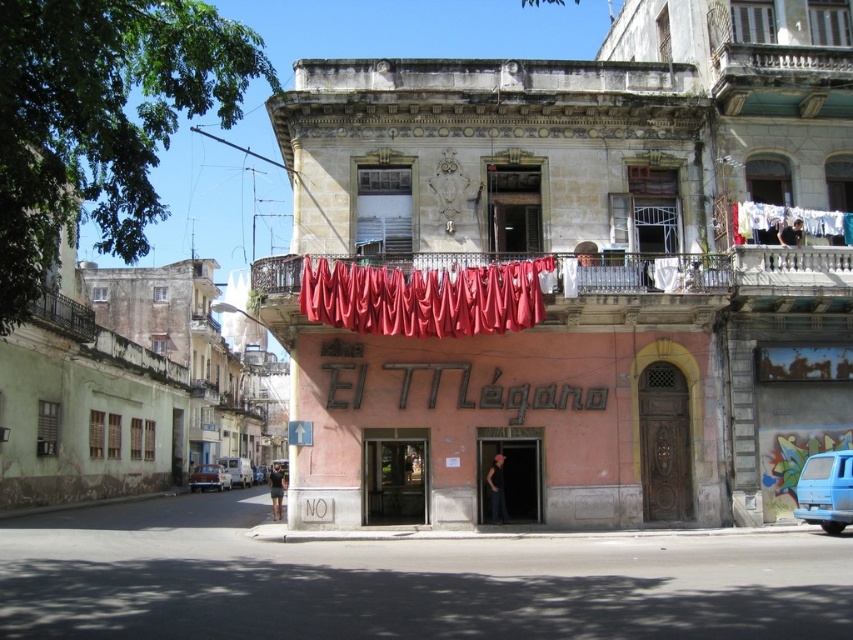
You are a delivery person who needs to park the blue matte van at lower right as close as possible to the white fabric at upper right without moving any objects. What is the closest distance you can get the van to the white fabric?

The closest distance you can get the blue matte van at lower right to the white fabric at upper right is 15.78 meters since that is the minimum distance between them as per the scene description.

You are a delivery person trying to reach the entrance of the building. You see two points marked in the image. The first point is at coordinate point (822,234) and the second point is at coordinate point (257,472). Which point is closer to you as you stand at the entrance?

Point (822,234) is closer to the camera than point (257,472), so the first point is closer to you as you stand at the entrance.